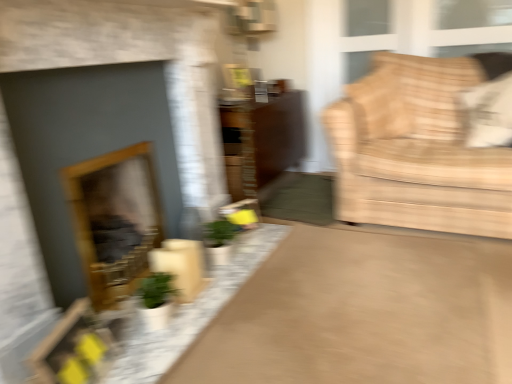
Question: Is metallic silver picture frame at upper center placed right next to beige fabric couch at right?

Choices:
 (A) no
 (B) yes

Answer: (A)

Question: Is metallic silver picture frame at upper center positioned beyond the bounds of beige fabric couch at right?

Choices:
 (A) yes
 (B) no

Answer: (A)

Question: From a real-world perspective, does metallic silver picture frame at upper center stand above beige fabric couch at right?

Choices:
 (A) yes
 (B) no

Answer: (A)

Question: From the image's perspective, is metallic silver picture frame at upper center below beige fabric couch at right?

Choices:
 (A) no
 (B) yes

Answer: (A)

Question: Could beige fabric couch at right be considered to be inside metallic silver picture frame at upper center?

Choices:
 (A) no
 (B) yes

Answer: (A)

Question: Is metallic silver picture frame at upper center at the right side of beige fabric couch at right?

Choices:
 (A) no
 (B) yes

Answer: (A)

Question: Does metallic silver picture frame at upper center have a lesser width compared to white fabric pillow at upper right?

Choices:
 (A) no
 (B) yes

Answer: (B)

Question: Considering the relative sizes of metallic silver picture frame at upper center and white fabric pillow at upper right in the image provided, is metallic silver picture frame at upper center smaller than white fabric pillow at upper right?

Choices:
 (A) yes
 (B) no

Answer: (A)

Question: From the image's perspective, is metallic silver picture frame at upper center located beneath white fabric pillow at upper right?

Choices:
 (A) no
 (B) yes

Answer: (A)

Question: Is metallic silver picture frame at upper center far from white fabric pillow at upper right?

Choices:
 (A) yes
 (B) no

Answer: (A)

Question: Is the position of metallic silver picture frame at upper center more distant than that of white fabric pillow at upper right?

Choices:
 (A) no
 (B) yes

Answer: (B)

Question: From a real-world perspective, is metallic silver picture frame at upper center physically below white fabric pillow at upper right?

Choices:
 (A) no
 (B) yes

Answer: (A)

Question: Does matte gray fireplace at left, the first fireplace from the front, have a larger size compared to white fabric pillow at upper right?

Choices:
 (A) no
 (B) yes

Answer: (B)